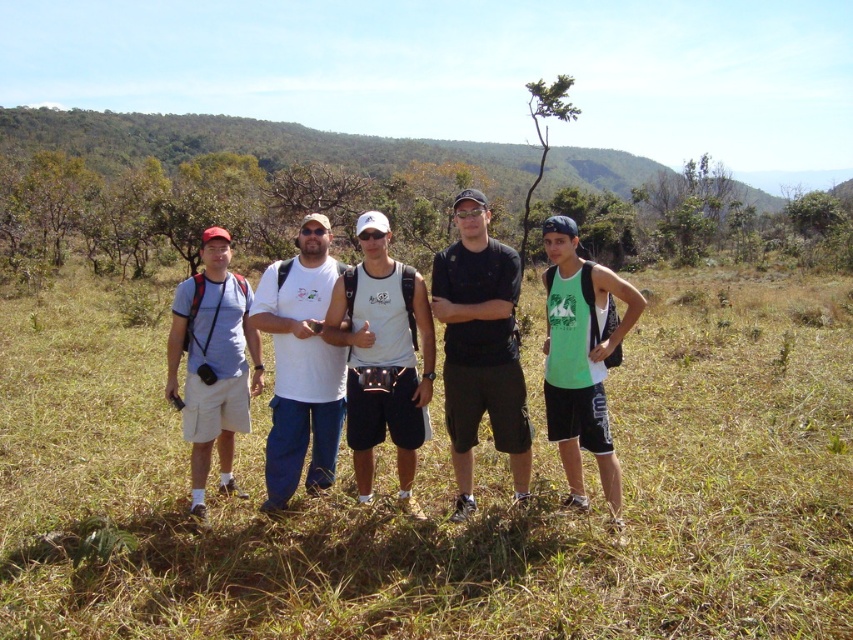
Based on the scene description, where is the green grassy field at center located in the image?

The green grassy field at center is located at point (x=444, y=488).

You are a photographer trying to capture a landscape shot. You have the green grassy field at center and the matte blue shirt at left in your frame. Which object is taller in the image?

The green grassy field at center is taller than the matte blue shirt at left.